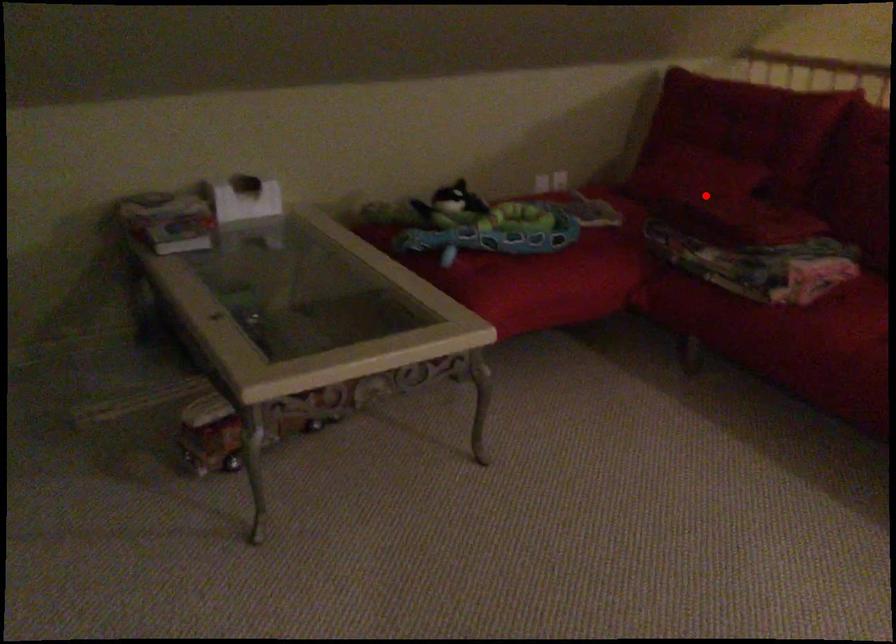
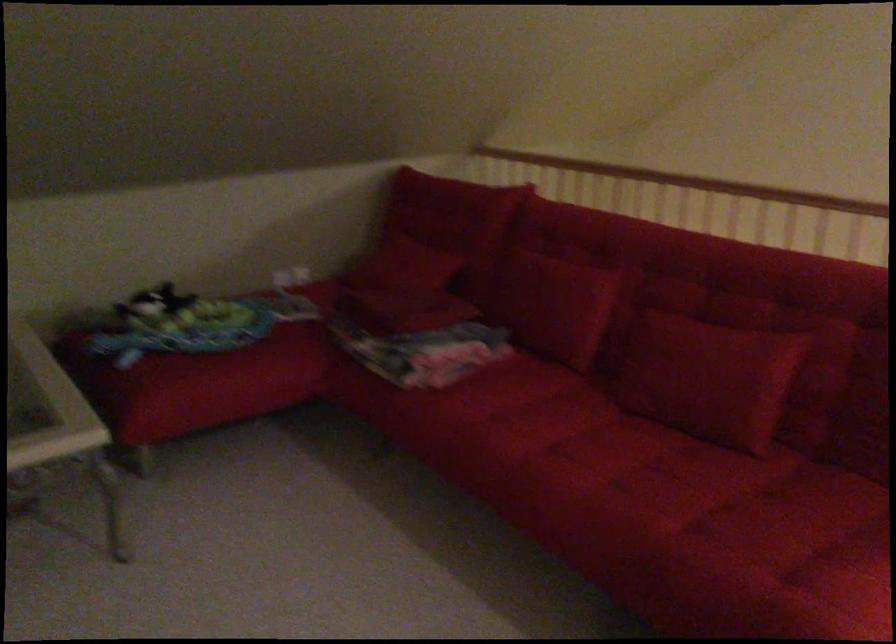
In the second image, find the point that corresponds to the highlighted location in the first image.

(402, 287)